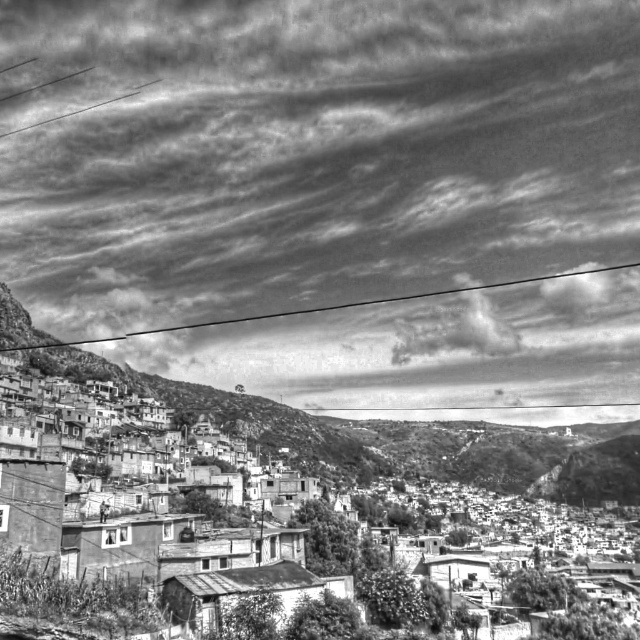
You are a delivery drone that needs to fly from the grainy concrete houses at lower left to the black wire at upper center. Is there any obstruction directly above the path between them?

The grainy concrete houses at lower left are positioned under the black wire at upper center, so there is an obstruction directly above the path between them.